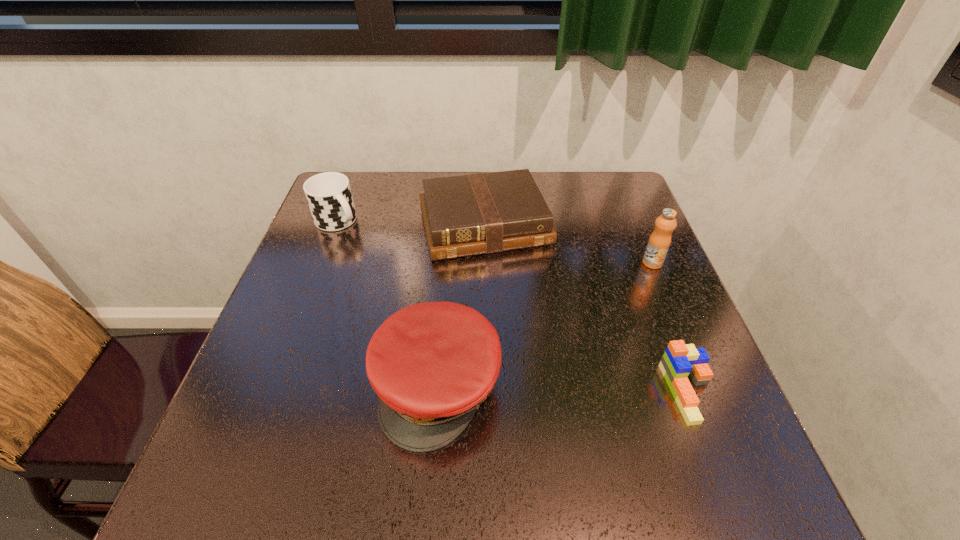
The image size is (960, 540). Find the location of `free spot between the Bible and the cup`. free spot between the Bible and the cup is located at coordinates click(x=411, y=223).

Image resolution: width=960 pixels, height=540 pixels. What are the coordinates of `vacant space in between the cap and the orange juice` in the screenshot? It's located at (545, 325).

Image resolution: width=960 pixels, height=540 pixels. I want to click on vacant area that lies between the Lego and the Bible, so click(x=587, y=308).

Where is `free spot between the Lego and the Bible`? The image size is (960, 540). free spot between the Lego and the Bible is located at coordinates (587, 308).

The image size is (960, 540). What are the coordinates of `free space between the cup and the Lego` in the screenshot? It's located at (514, 307).

In order to click on vacant area between the Bible and the Lego in this screenshot , I will do `click(587, 308)`.

The height and width of the screenshot is (540, 960). I want to click on vacant point located between the Bible and the Lego, so click(x=587, y=308).

Image resolution: width=960 pixels, height=540 pixels. In order to click on vacant space in between the cup and the cap in this screenshot , I will do `click(388, 304)`.

Find the location of a particular element. Image resolution: width=960 pixels, height=540 pixels. the second closest object to the tallest object is located at coordinates (679, 360).

Locate an element on the screen. The image size is (960, 540). the third closest object to the Bible is located at coordinates (431, 364).